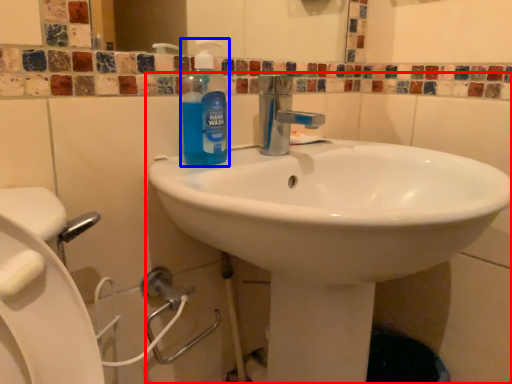
Question: Which of the following is the closest to the observer, sink (highlighted by a red box) or cleaning product (highlighted by a blue box)?

Choices:
 (A) sink
 (B) cleaning product

Answer: (A)